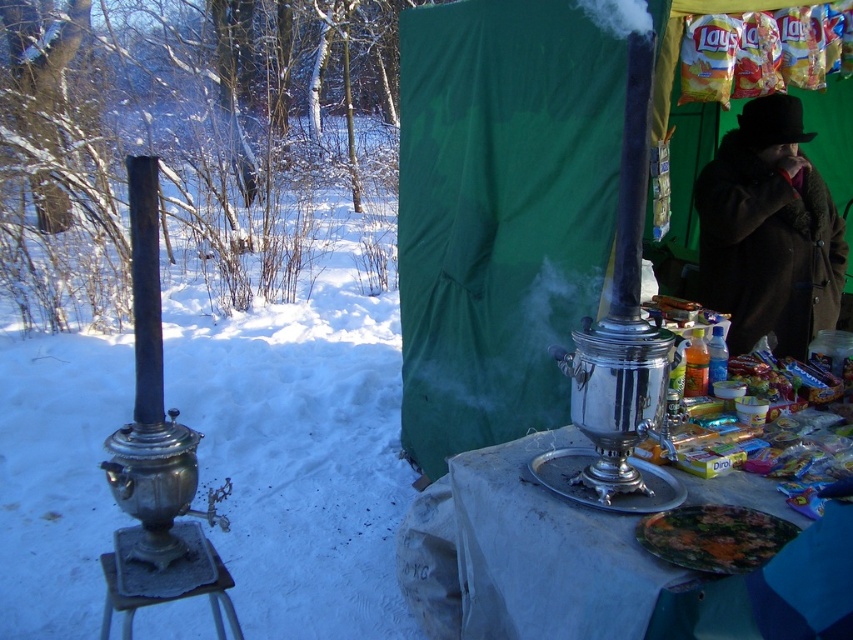
Question: Which of these objects is positioned closest to the shiny silver samovar at center?

Choices:
 (A) brown woolen coat at right
 (B) shiny metallic samovar at center

Answer: (B)

Question: Which of the following is the closest to the observer?

Choices:
 (A) shiny metallic samovar at center
 (B) brown woolen coat at right

Answer: (A)

Question: Can you confirm if shiny metallic samovar at center is smaller than brown woolen coat at right?

Choices:
 (A) yes
 (B) no

Answer: (B)

Question: Is shiny silver samovar at center thinner than brown woolen coat at right?

Choices:
 (A) no
 (B) yes

Answer: (B)

Question: Which of the following is the closest to the observer?

Choices:
 (A) (712, 296)
 (B) (784, 627)
 (C) (465, 161)

Answer: (B)

Question: Does shiny silver samovar at center appear on the left side of brown woolen coat at right?

Choices:
 (A) yes
 (B) no

Answer: (A)